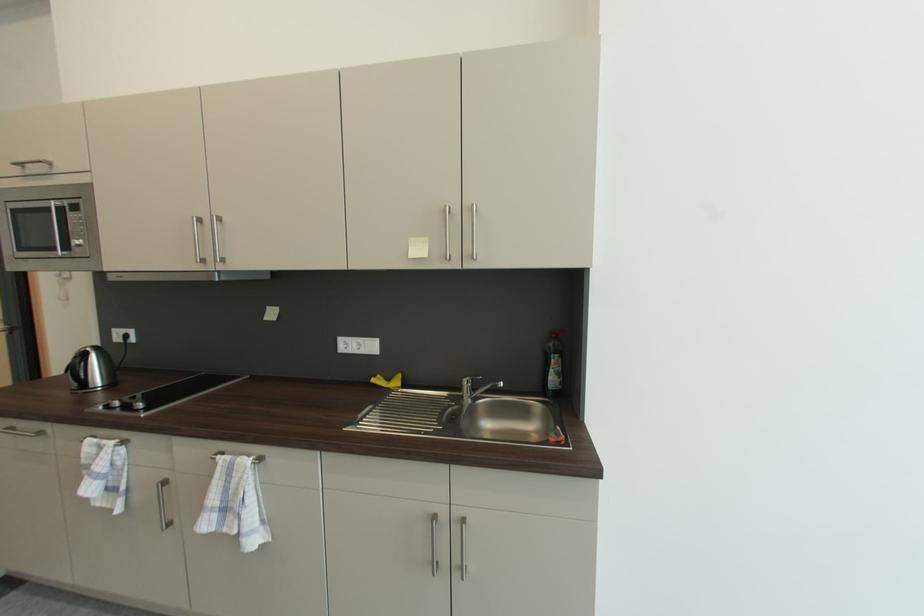
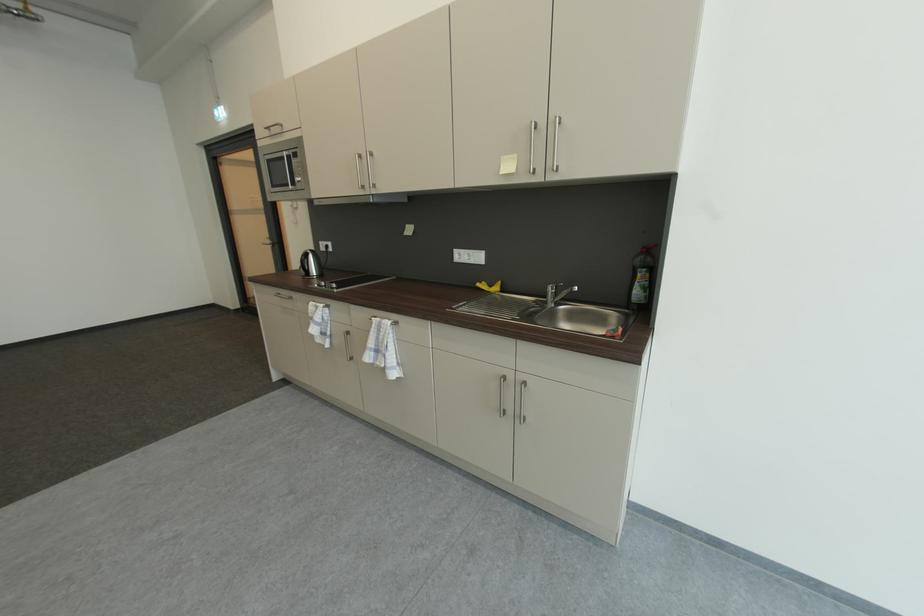
Locate, in the second image, the point that corresponds to (x=468, y=399) in the first image.

(553, 304)